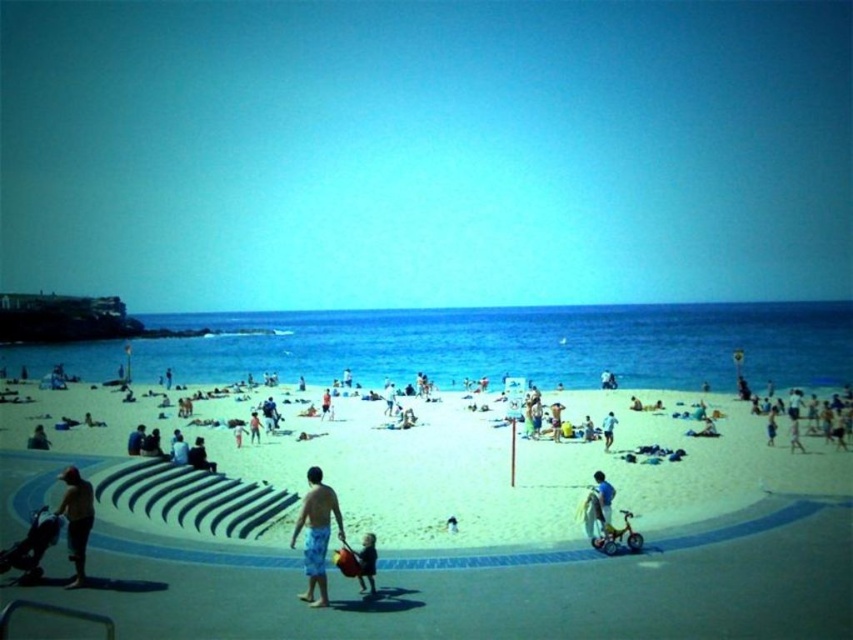
Based on the photo, you are standing on the beach and see the white sand at center and the matte black shorts at lower left. Which object is closer to you?

The white sand at center is closer to you than the matte black shorts at lower left.

You are a photographer trying to capture a closeup shot of the light blue fabric at lower right and the smooth tan skin at lower left. Which object should you zoom in on to ensure it fits within your camera frame without cropping?

The light blue fabric at lower right has a lesser width compared to smooth tan skin at lower left, so you should zoom in on the smooth tan skin at lower left to ensure it fits within the camera frame without cropping.

You are a photographer trying to capture a candid shot of the blue striped shorts at center and the smooth tan skin at lower left. Since you want both subjects in focus, you need to know their heights. Which one is shorter?

The blue striped shorts at center is shorter than smooth tan skin at lower left.